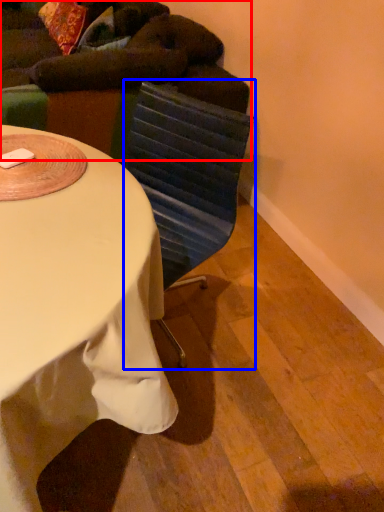
Question: Which object is closer to the camera taking this photo, bean bag chair (highlighted by a red box) or swivel chair (highlighted by a blue box)?

Choices:
 (A) bean bag chair
 (B) swivel chair

Answer: (B)